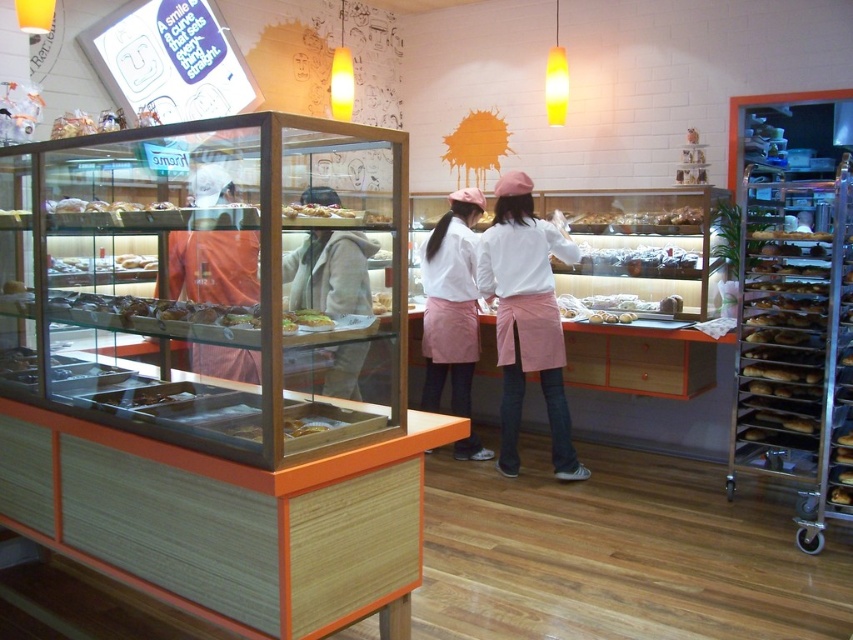
Which of these two, matte white bread at center or matte glass bread at center, stands taller?

matte white bread at center

Does point (560, 308) lie in front of point (332, 205)?

No.

Does point (611, 301) lie behind point (328, 212)?

Yes.

Identify the location of matte white bread at center. The image size is (853, 640). (618, 307).

Can you confirm if golden brown crusty bread at center is positioned below matte glass bread at center?

Correct, golden brown crusty bread at center is located below matte glass bread at center.

Does point (106, 308) come farther from viewer compared to point (355, 216)?

Yes.

Is point (190, 304) in front of point (337, 211)?

That is False.

The height and width of the screenshot is (640, 853). In order to click on golden brown crusty bread at center in this screenshot , I will do `click(154, 310)`.

Between point (222, 262) and point (335, 209), which one is positioned behind?

The point (222, 262) is behind.

Can you confirm if orange fabric at center is positioned to the left of matte glass bread at center?

Yes, orange fabric at center is to the left of matte glass bread at center.

Identify the location of orange fabric at center. The height and width of the screenshot is (640, 853). (213, 266).

Locate an element on the screen. orange fabric at center is located at coordinates pyautogui.click(x=213, y=266).